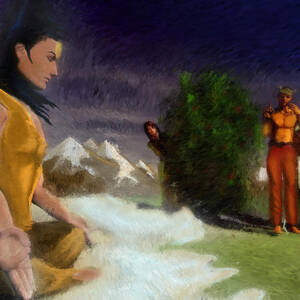
Where is `chest`? This screenshot has width=300, height=300. chest is located at coordinates (290, 121), (280, 121), (40, 146), (16, 140).